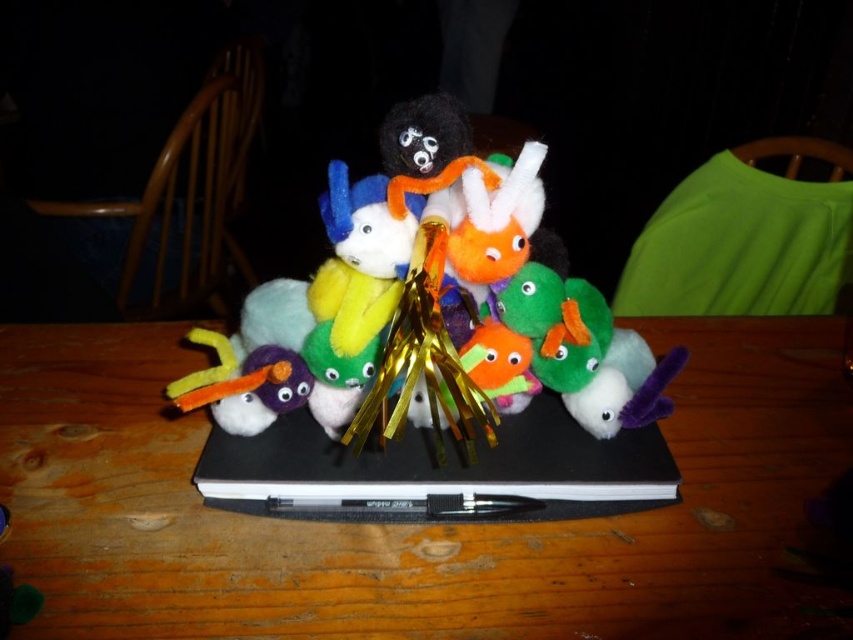
Between point (560, 620) and point (671, 490), which one is positioned behind?

The point (671, 490) is more distant.

What are the coordinates of `wooden table at center` in the screenshot? It's located at (415, 525).

I want to click on wooden table at center, so click(x=415, y=525).

Looking at this image, does wooden table at center lie behind fuzzy multicolored stuffed animals at center?

Yes, wooden table at center is behind fuzzy multicolored stuffed animals at center.

Which of these two, wooden table at center or fuzzy multicolored stuffed animals at center, stands taller?

With more height is fuzzy multicolored stuffed animals at center.

Which is in front, point (146, 433) or point (509, 324)?

Point (509, 324)

I want to click on wooden table at center, so click(x=415, y=525).

Can you confirm if fuzzy multicolored stuffed animals at center is positioned to the right of black matte laptop at center?

Yes, fuzzy multicolored stuffed animals at center is to the right of black matte laptop at center.

Is point (505, 209) positioned before point (277, 506)?

Yes, it is.

What do you see at coordinates (450, 291) in the screenshot? The image size is (853, 640). I see `fuzzy multicolored stuffed animals at center` at bounding box center [450, 291].

I want to click on fuzzy multicolored stuffed animals at center, so click(450, 291).